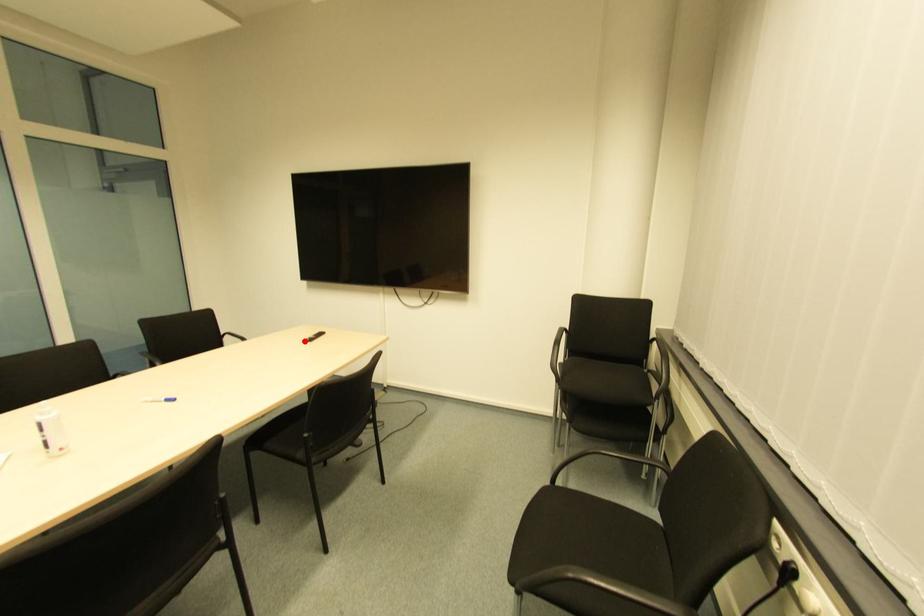
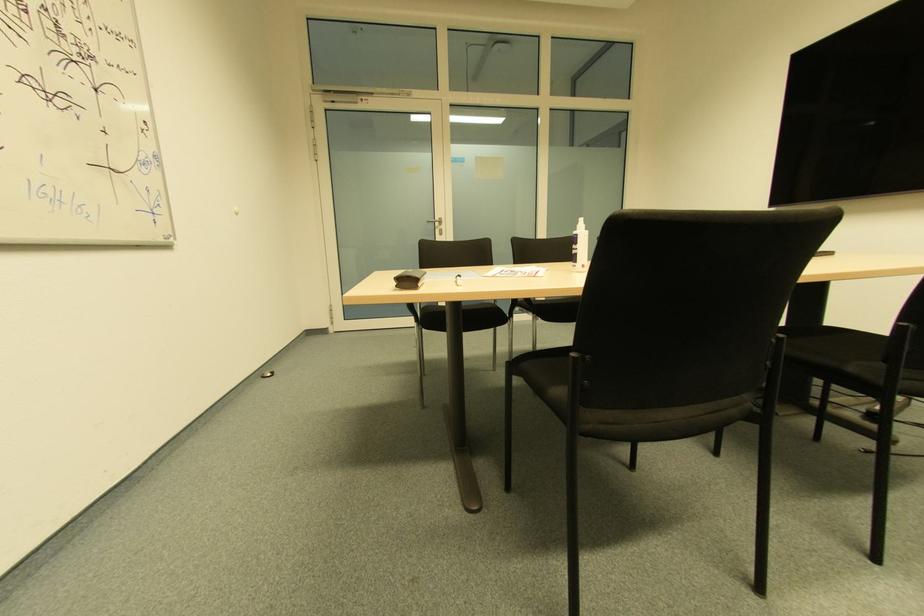
Question: I am providing you with two images of the same scene from different viewpoints. A red point is marked on the first image. At the location where the point appears in image 1, is it still visible in image 2?

Choices:
 (A) Yes
 (B) No

Answer: (B)